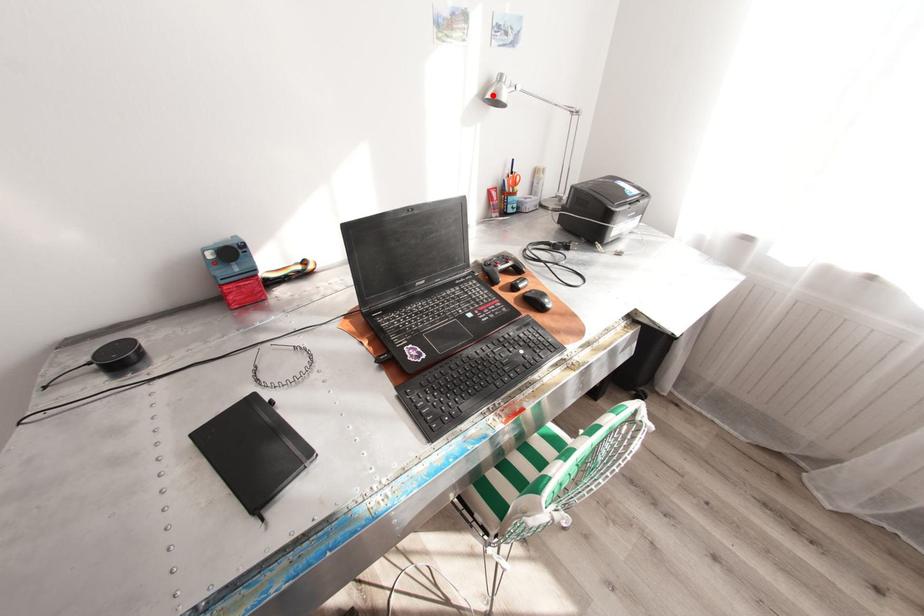
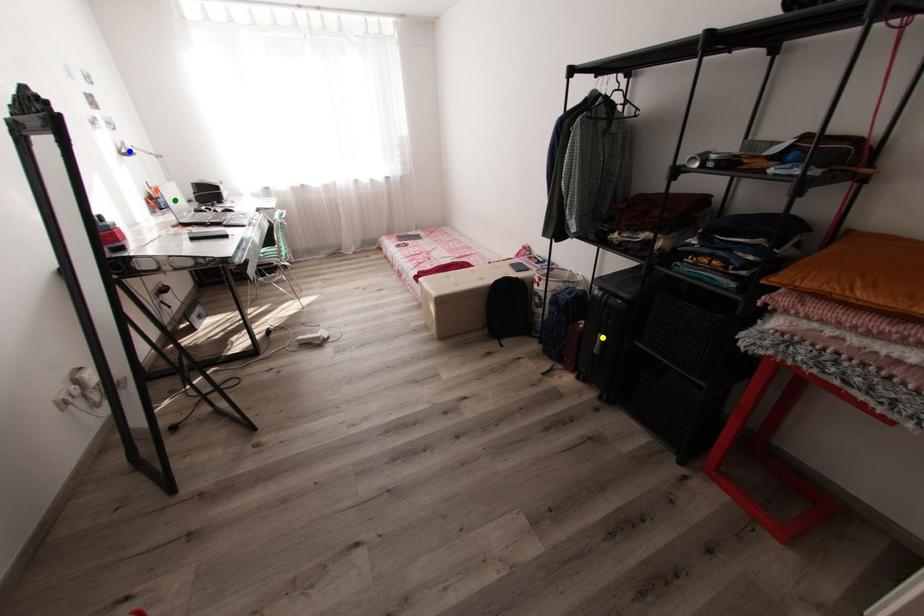
Question: I am providing you with two images of the same scene from different viewpoints. A red point is marked on the first image. You are given multiple points on the second image. Which point in image 2 represents the same 3d spot as the red point in image 1?

Choices:
 (A) blue point
 (B) yellow point
 (C) green point

Answer: (A)